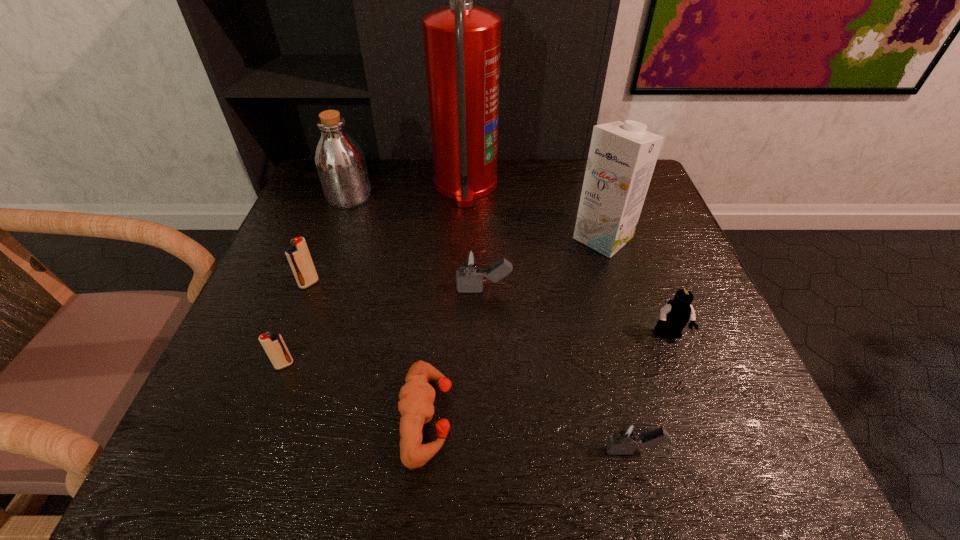
I want to click on the nearer red igniter, so 274,345.

I want to click on the smaller red igniter, so click(x=274, y=345).

The height and width of the screenshot is (540, 960). Identify the location of the nearest igniter. tap(626, 436).

Locate an element on the screen. The width and height of the screenshot is (960, 540). the right gray igniter is located at coordinates (626, 436).

Locate an element on the screen. This screenshot has width=960, height=540. the shortest object is located at coordinates (417, 396).

At what (x,y) coordinates should I click in order to perform the action: click on puncher. Please return your answer as a coordinate pair (x, y). This screenshot has height=540, width=960. Looking at the image, I should click on (417, 396).

Image resolution: width=960 pixels, height=540 pixels. I want to click on vacant space located 0.260m on the instruction side of the red fire extinguisher, so click(x=591, y=185).

The image size is (960, 540). Identify the location of free space located on the front of the second tallest object. (650, 390).

Where is `free region located on the front of the bottle`? free region located on the front of the bottle is located at coordinates (335, 235).

This screenshot has width=960, height=540. What are the coordinates of `free spot located on the front of the second igniter from right to left` in the screenshot? It's located at (485, 391).